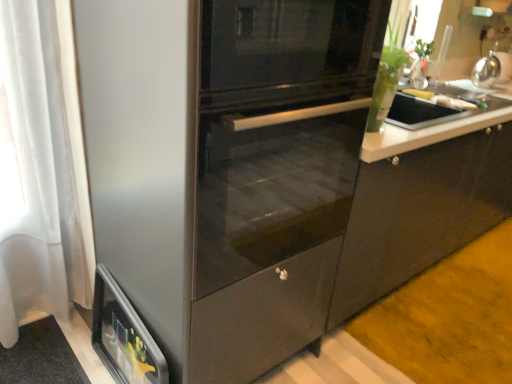
Identify the location of vacant space to the right of white glossy plate at upper right, positioned as the 1th food in front-to-back order. Image resolution: width=512 pixels, height=384 pixels. (485, 105).